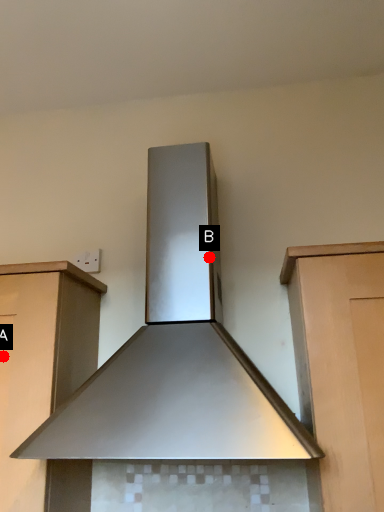
Question: Two points are circled on the image, labeled by A and B beside each circle. Which point is farther from the camera taking this photo?

Choices:
 (A) A is further
 (B) B is further

Answer: (B)